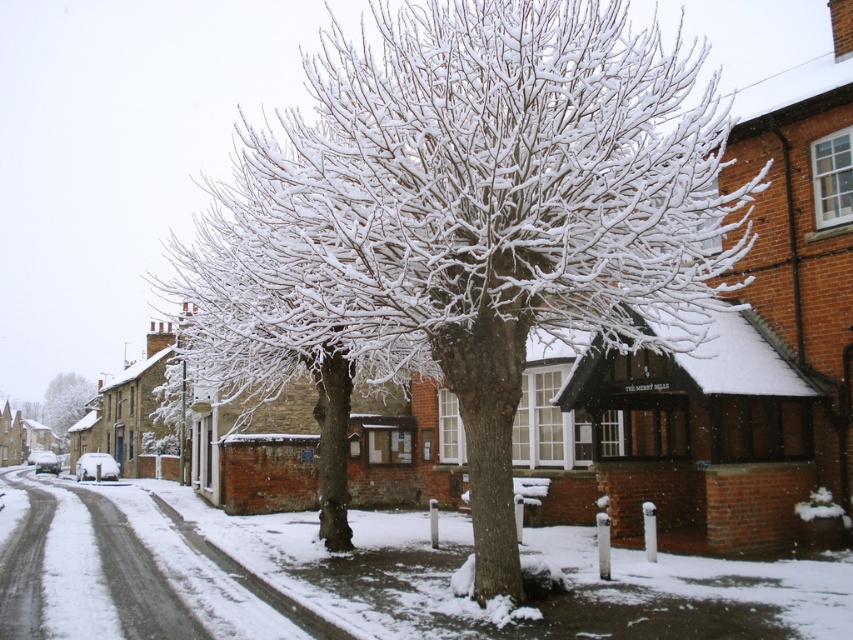
Between snow-covered branches at center and white powdery snow at center, which one appears on the left side from the viewer's perspective?

Positioned to the left is white powdery snow at center.

Does point (631, 330) come farther from viewer compared to point (131, 588)?

No, (631, 330) is in front of (131, 588).

Is point (677, 326) positioned before point (94, 490)?

Yes, it is in front of point (94, 490).

Identify the location of snow-covered branches at center. (463, 221).

Who is more forward, [395,330] or [49,416]?

Point [395,330] is in front.

Based on the photo, is snow-covered branches at center taller than white frosty tree at left?

Yes.

You are a GUI agent. You are given a task and a screenshot of the screen. Output one action in this format:
    pyautogui.click(x=<x>, y=<y>)
    Task: Click on the snow-covered branches at center
    This screenshot has height=640, width=853.
    Given the screenshot: What is the action you would take?
    pyautogui.click(x=463, y=221)

The image size is (853, 640). Find the location of `snow-covered branches at center`. snow-covered branches at center is located at coordinates coord(463,221).

Is white powdery snow at center below white frosty tree at left?

Incorrect, white powdery snow at center is not positioned below white frosty tree at left.

Does point (148, 570) come behind point (61, 417)?

No, (148, 570) is closer to viewer.

Between point (334, 632) and point (90, 385), which one is positioned in front?

Point (334, 632) is more forward.

At what (x,y) coordinates should I click in order to perform the action: click on white powdery snow at center. Please return your answer as a coordinate pair (x, y). Looking at the image, I should click on (352, 577).